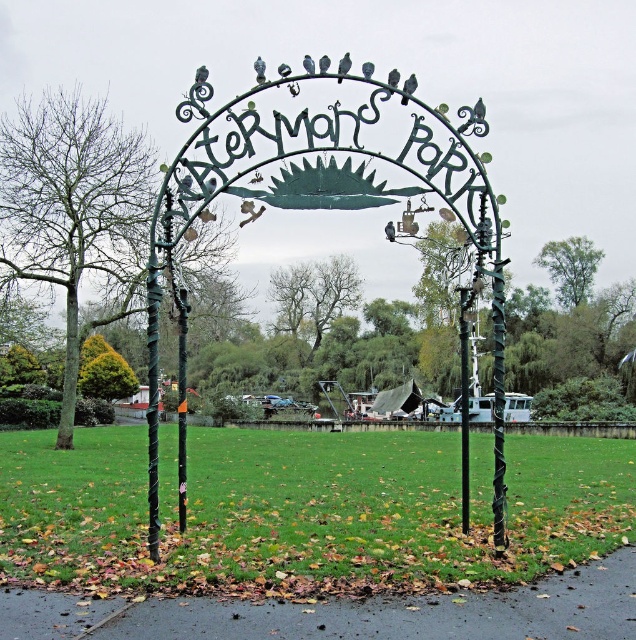
You are standing under the decorative metal archway at Aterman Park and notice two gray matte birds perched on the arch. The dark gray matte bird at upper center and the gray matte bird at center. Which of these two birds is smaller in size?

The dark gray matte bird at upper center is smaller in size compared to the gray matte bird at center.

You are standing at the entrance of Aterman Park and see the decorative metal archway with its intricate sun motif. There is a point marked at coordinates (478, 112). What object is located at this point?

The point at coordinates (478, 112) indicates a dark gray matte bird at upper center.